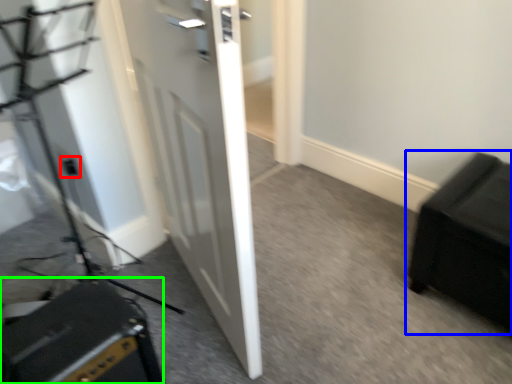
Question: Which object is the closest to the electric outlet (highlighted by a red box)? Choose among these: furniture (highlighted by a blue box) or speaker (highlighted by a green box).

Choices:
 (A) furniture
 (B) speaker

Answer: (B)